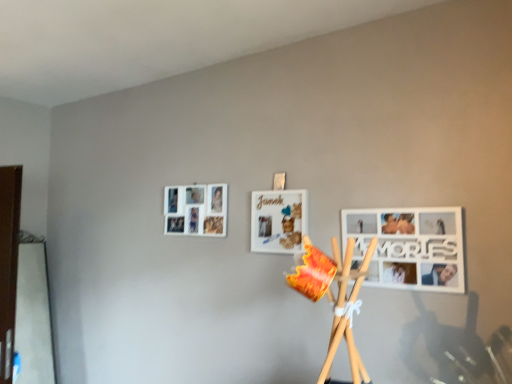
Question: Is white matte picture frame at lower right, arranged as the 3th picture frame when viewed from the left, looking in the opposite direction of white matte picture frame at center, the 2th picture frame when ordered from back to front?

Choices:
 (A) yes
 (B) no

Answer: (B)

Question: Considering the relative sizes of white matte picture frame at lower right, arranged as the 3th picture frame when viewed from the left, and white matte picture frame at center, the 2th picture frame when ordered from back to front, in the image provided, is white matte picture frame at lower right, arranged as the 3th picture frame when viewed from the left, shorter than white matte picture frame at center, the 2th picture frame when ordered from back to front,?

Choices:
 (A) yes
 (B) no

Answer: (B)

Question: Can white matte picture frame at center, the 2th picture frame from the front, be found inside white matte picture frame at lower right, the 1th picture frame in the front-to-back sequence?

Choices:
 (A) yes
 (B) no

Answer: (B)

Question: Is white matte picture frame at lower right, the third picture frame in the back-to-front sequence, at the left side of white matte picture frame at center, positioned as the second picture frame in right-to-left order?

Choices:
 (A) yes
 (B) no

Answer: (B)

Question: Is white matte picture frame at lower right, arranged as the 3th picture frame when viewed from the left, positioned beyond the bounds of white matte picture frame at center, acting as the second picture frame starting from the left?

Choices:
 (A) no
 (B) yes

Answer: (B)

Question: Is white matte picture frame at center, positioned as the second picture frame in right-to-left order, wider or thinner than white matte picture frame at upper left, positioned as the 1th picture frame in back-to-front order?

Choices:
 (A) thin
 (B) wide

Answer: (B)

Question: In terms of height, does white matte picture frame at center, positioned as the second picture frame in right-to-left order, look taller or shorter compared to white matte picture frame at upper left, positioned as the 1th picture frame in back-to-front order?

Choices:
 (A) tall
 (B) short

Answer: (A)

Question: Is white matte picture frame at center, the 2th picture frame from the front, inside or outside of white matte picture frame at upper left, which appears as the third picture frame when viewed from the front?

Choices:
 (A) outside
 (B) inside

Answer: (A)

Question: Considering the relative positions of white matte picture frame at center, positioned as the second picture frame in right-to-left order, and white matte picture frame at upper left, which appears as the third picture frame when viewed from the front, in the image provided, is white matte picture frame at center, positioned as the second picture frame in right-to-left order, to the left or to the right of white matte picture frame at upper left, which appears as the third picture frame when viewed from the front,?

Choices:
 (A) right
 (B) left

Answer: (A)

Question: Considering their positions, is white matte picture frame at lower right, the 1th picture frame in the front-to-back sequence, located in front of or behind white matte picture frame at center, positioned as the second picture frame in right-to-left order?

Choices:
 (A) front
 (B) behind

Answer: (A)

Question: From the image's perspective, relative to white matte picture frame at center, the 2th picture frame when ordered from back to front, is white matte picture frame at lower right, arranged as the 3th picture frame when viewed from the left, above or below?

Choices:
 (A) below
 (B) above

Answer: (A)

Question: From a real-world perspective, relative to white matte picture frame at center, acting as the second picture frame starting from the left, is white matte picture frame at lower right, the 1th picture frame in the front-to-back sequence, vertically above or below?

Choices:
 (A) below
 (B) above

Answer: (A)

Question: Choose the correct answer: Is white matte picture frame at lower right, the third picture frame in the back-to-front sequence, inside white matte picture frame at center, acting as the second picture frame starting from the left, or outside it?

Choices:
 (A) outside
 (B) inside

Answer: (A)

Question: Is white matte picture frame at upper left, the 1th picture frame from the left, wider or thinner than white matte picture frame at center, the 2th picture frame when ordered from back to front?

Choices:
 (A) thin
 (B) wide

Answer: (A)

Question: Is point (208, 193) closer or farther from the camera than point (294, 195)?

Choices:
 (A) farther
 (B) closer

Answer: (A)